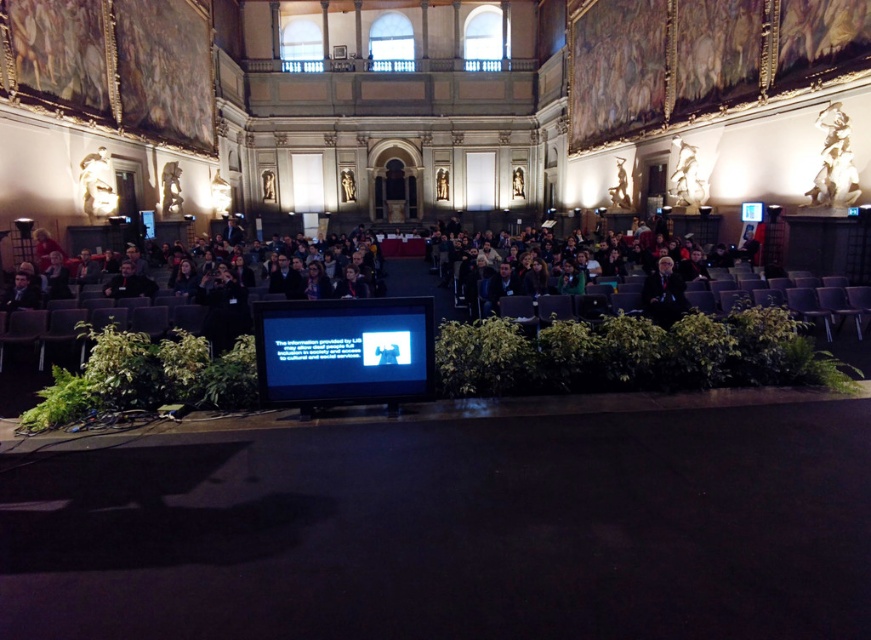
Question: Which of the following is the closest to the observer?

Choices:
 (A) matte black screen at center
 (B) dark blue suit at center

Answer: (A)

Question: Does matte black screen at center have a smaller size compared to dark blue suit at center?

Choices:
 (A) yes
 (B) no

Answer: (A)

Question: From the image, what is the correct spatial relationship of matte black screen at center in relation to dark blue suit at center?

Choices:
 (A) below
 (B) above

Answer: (A)

Question: Can you confirm if matte black screen at center is positioned below dark blue suit at center?

Choices:
 (A) yes
 (B) no

Answer: (A)

Question: Which of the following is the closest to the observer?

Choices:
 (A) dark blue suit at center
 (B) matte black screen at center

Answer: (B)